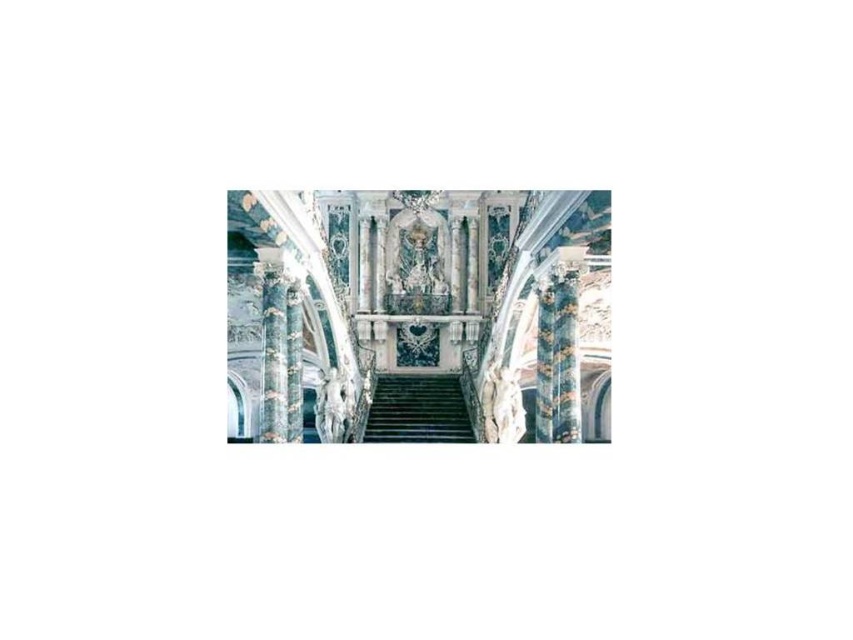
Does point (248, 272) lie in front of point (444, 440)?

Yes, point (248, 272) is closer to viewer.

Is point (332, 252) farther from viewer compared to point (373, 428)?

Yes, point (332, 252) is farther from viewer.

At what (x,y) coordinates should I click in order to perform the action: click on white marble staircase at center. Please return your answer as a coordinate pair (x, y). The width and height of the screenshot is (853, 640). Looking at the image, I should click on (421, 310).